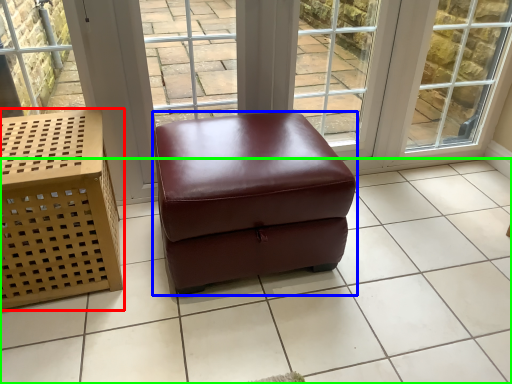
Question: Which object is positioned farthest from furniture (highlighted by a red box)? Select from stool (highlighted by a blue box) and tile (highlighted by a green box).

Choices:
 (A) stool
 (B) tile

Answer: (B)